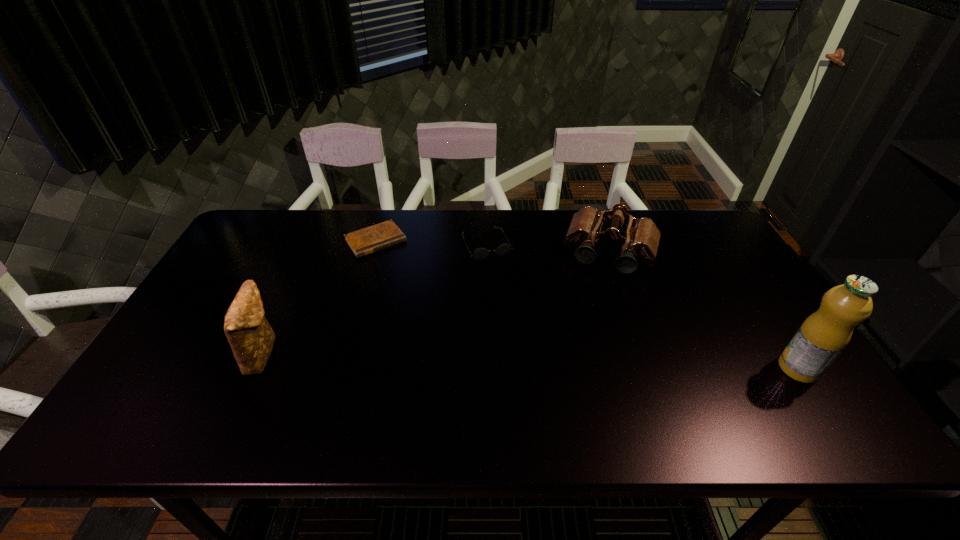
At what (x,y) coordinates should I click in order to perform the action: click on the second tallest object. Please return your answer as a coordinate pair (x, y). The image size is (960, 540). Looking at the image, I should click on (249, 334).

Locate an element on the screen. clutch bag is located at coordinates (249, 334).

The width and height of the screenshot is (960, 540). What are the coordinates of `the rightmost object` in the screenshot? It's located at (820, 339).

This screenshot has height=540, width=960. What are the coordinates of `fruit juice` in the screenshot? It's located at (820, 339).

In order to click on the third object from left to right in this screenshot , I will do `click(480, 254)`.

Where is `sunglasses`? This screenshot has height=540, width=960. sunglasses is located at coordinates (480, 254).

At what (x,y) coordinates should I click in order to perform the action: click on diary. Please return your answer as a coordinate pair (x, y). Looking at the image, I should click on (362, 242).

You are a GUI agent. You are given a task and a screenshot of the screen. Output one action in this format:
    pyautogui.click(x=<x>, y=<y>)
    Task: Click on the shortest object
    
    Given the screenshot: What is the action you would take?
    pyautogui.click(x=362, y=242)

The width and height of the screenshot is (960, 540). What are the coordinates of `the second object from right to left` in the screenshot? It's located at (641, 239).

You are a GUI agent. You are given a task and a screenshot of the screen. Output one action in this format:
    pyautogui.click(x=<x>, y=<y>)
    Task: Click on the binoculars
    
    Given the screenshot: What is the action you would take?
    pyautogui.click(x=641, y=239)